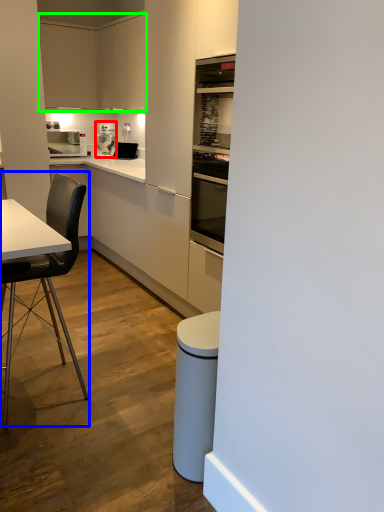
Question: Which object is positioned farthest from kitchen appliance (highlighted by a red box)? Select from chair (highlighted by a blue box) and cabinetry (highlighted by a green box).

Choices:
 (A) chair
 (B) cabinetry

Answer: (A)